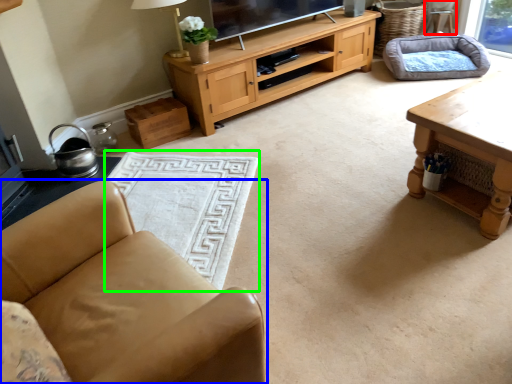
Question: Which object is the farthest from armchair (highlighted by a red box)? Choose among these: chair (highlighted by a blue box) or flat (highlighted by a green box).

Choices:
 (A) chair
 (B) flat

Answer: (A)